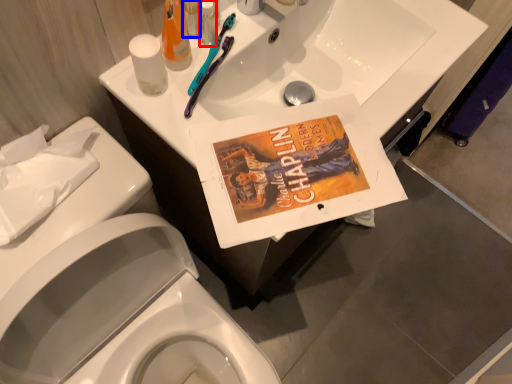
Question: Which of the following is the closest to the observer, toiletry (highlighted by a red box) or toiletry (highlighted by a blue box)?

Choices:
 (A) toiletry
 (B) toiletry

Answer: (A)